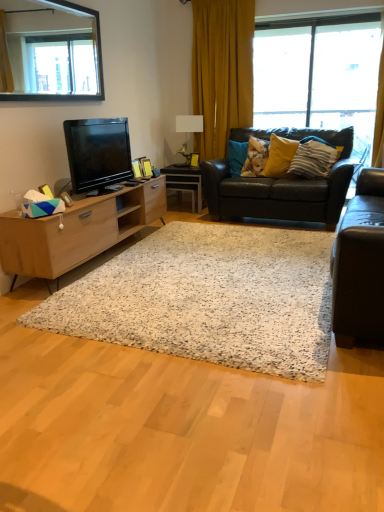
Where is `white glossy lamp at upper center`? This screenshot has width=384, height=512. white glossy lamp at upper center is located at coordinates (189, 123).

At what (x,y) coordinates should I click in order to perform the action: click on white shag rug at center. Please return your answer as a coordinate pair (x, y). The width and height of the screenshot is (384, 512). Looking at the image, I should click on (209, 298).

The height and width of the screenshot is (512, 384). Describe the element at coordinates (209, 298) in the screenshot. I see `white shag rug at center` at that location.

How much space does yellow matte pillow at upper right, acting as the second pillow starting from the left, occupy horizontally?

It is 27.36 centimeters.

How much space does yellow matte pillow at upper right, acting as the second pillow starting from the left, occupy vertically?

yellow matte pillow at upper right, acting as the second pillow starting from the left, is 18.69 inches tall.

The image size is (384, 512). What do you see at coordinates (318, 71) in the screenshot?
I see `transparent glass window at upper right` at bounding box center [318, 71].

This screenshot has width=384, height=512. In order to click on white glossy lamp at upper center in this screenshot , I will do `click(189, 123)`.

Is transparent glass window at upper right far from leather couch at right, the second studio couch positioned from the back?

transparent glass window at upper right is far away from leather couch at right, the second studio couch positioned from the back.

Considering the sizes of objects transparent glass window at upper right and leather couch at right, the second studio couch positioned from the back, in the image provided, who is taller, transparent glass window at upper right or leather couch at right, the second studio couch positioned from the back,?

Standing taller between the two is transparent glass window at upper right.

Between transparent glass window at upper right and leather couch at right, the second studio couch positioned from the back, which one has larger width?

Wider between the two is leather couch at right, the second studio couch positioned from the back.

How many degrees apart are the facing directions of black glass mirror at upper left and transparent glass window at upper right?

90.4 degrees separate the facing orientations of black glass mirror at upper left and transparent glass window at upper right.

From a real-world perspective, is black glass mirror at upper left on top of transparent glass window at upper right?

Yes, from a real-world perspective, black glass mirror at upper left is on top of transparent glass window at upper right.

Would you say black glass mirror at upper left is outside transparent glass window at upper right?

Indeed, black glass mirror at upper left is completely outside transparent glass window at upper right.

Is black glass mirror at upper left far away from transparent glass window at upper right?

black glass mirror at upper left is positioned a significant distance from transparent glass window at upper right.

Can you confirm if leather couch at center, arranged as the second studio couch when viewed from the front, is positioned to the right of fluffy fabric pillow at center, placed as the third pillow when sorted from right to left?

Yes.

Considering the relative sizes of leather couch at center, marked as the first studio couch in a back-to-front arrangement, and fluffy fabric pillow at center, which is counted as the first pillow, starting from the left, in the image provided, is leather couch at center, marked as the first studio couch in a back-to-front arrangement, bigger than fluffy fabric pillow at center, which is counted as the first pillow, starting from the left,?

Indeed, leather couch at center, marked as the first studio couch in a back-to-front arrangement, has a larger size compared to fluffy fabric pillow at center, which is counted as the first pillow, starting from the left.

Locate an element on the screen. The height and width of the screenshot is (512, 384). pillow that is on the left side of leather couch at center, marked as the first studio couch in a back-to-front arrangement is located at coordinates (255, 157).

From a real-world perspective, which object stands above the other?

In real-world perspective, fluffy fabric pillow at center, which is counted as the first pillow, starting from the left, is above.

The image size is (384, 512). What are the coordinates of `cabinetry that appears on the left of white shag rug at center` in the screenshot? It's located at (77, 230).

From the image's perspective, which object appears higher, light wood/finish tv stand at left or white shag rug at center?

light wood/finish tv stand at left is shown above in the image.

Which is less distant, (36, 226) or (56, 318)?

Clearly, point (36, 226) is more distant from the camera than point (56, 318).

Does light wood/finish tv stand at left contain white shag rug at center?

That's incorrect, white shag rug at center is not inside light wood/finish tv stand at left.

Is transparent glass window at upper right oriented towards yellow striped pillow at upper right, which is counted as the third pillow, starting from the left?

Yes.

Is transparent glass window at upper right not inside yellow striped pillow at upper right, which appears as the 1th pillow when viewed from the right?

Indeed, transparent glass window at upper right is completely outside yellow striped pillow at upper right, which appears as the 1th pillow when viewed from the right.

Is transparent glass window at upper right taller or shorter than yellow striped pillow at upper right, which is counted as the third pillow, starting from the left?

Considering their sizes, transparent glass window at upper right has more height than yellow striped pillow at upper right, which is counted as the third pillow, starting from the left.

From the image's perspective, is transparent glass window at upper right above or below yellow matte pillow at upper right, acting as the second pillow starting from the left?

Based on their image positions, transparent glass window at upper right is located above yellow matte pillow at upper right, acting as the second pillow starting from the left.

Which object is further away from the camera taking this photo, transparent glass window at upper right or yellow matte pillow at upper right, which is the second pillow in right-to-left order?

transparent glass window at upper right is behind.

In terms of size, does transparent glass window at upper right appear bigger or smaller than yellow matte pillow at upper right, which is the second pillow in right-to-left order?

Clearly, transparent glass window at upper right is larger in size than yellow matte pillow at upper right, which is the second pillow in right-to-left order.

Relative to light wood/finish tv stand at left, is transparent glass window at upper right in front or behind?

transparent glass window at upper right is positioned farther from the viewer than light wood/finish tv stand at left.

Is transparent glass window at upper right oriented towards light wood/finish tv stand at left?

Yes, transparent glass window at upper right faces towards light wood/finish tv stand at left.

From the image's perspective, is transparent glass window at upper right above or below light wood/finish tv stand at left?

transparent glass window at upper right is above light wood/finish tv stand at left.

The width and height of the screenshot is (384, 512). What are the coordinates of `cabinetry on the left of transparent glass window at upper right` in the screenshot? It's located at (77, 230).

At what (x,y) coordinates should I click in order to perform the action: click on studio couch that is the 1st one when counting leftward from the transparent glass window at upper right. Please return your answer as a coordinate pair (x, y). Looking at the image, I should click on (360, 264).

At what (x,y) coordinates should I click in order to perform the action: click on window that is above the black glass mirror at upper left (from the image's perspective). Please return your answer as a coordinate pair (x, y). Looking at the image, I should click on (318, 71).

When comparing their distances from leather couch at center, arranged as the second studio couch when viewed from the front, does white shag rug at center or transparent glass window at upper right seem further?

white shag rug at center.

Based on the photo, from the image, which object appears to be nearer to black glossy television at left, white shag rug at center or white glossy desk at center?

white shag rug at center is positioned closer to the anchor black glossy television at left.

From the image, which object appears to be nearer to white glossy desk at center, black glossy television at left or leather couch at right, the second studio couch positioned from the back?

black glossy television at left is positioned closer to the anchor white glossy desk at center.

From the picture: Based on their spatial positions, is leather couch at center, arranged as the second studio couch when viewed from the front, or white shag rug at center further from white glossy desk at center?

The object further to white glossy desk at center is white shag rug at center.

When comparing their distances from black glass mirror at upper left, does black glossy television at left or white glossy desk at center seem closer?

Based on the image, black glossy television at left appears to be nearer to black glass mirror at upper left.

When comparing their distances from leather couch at center, marked as the first studio couch in a back-to-front arrangement, does leather couch at right, the second studio couch positioned from the back, or white shag rug at center seem closer?

Among the two, white shag rug at center is located nearer to leather couch at center, marked as the first studio couch in a back-to-front arrangement.

Based on the photo, when comparing their distances from fluffy fabric pillow at center, placed as the third pillow when sorted from right to left, does black glossy television at left or yellow matte pillow at upper right, which is the second pillow in right-to-left order, seem closer?

Based on the image, yellow matte pillow at upper right, which is the second pillow in right-to-left order, appears to be nearer to fluffy fabric pillow at center, placed as the third pillow when sorted from right to left.

Considering their positions, is white glossy lamp at upper center positioned further to white shag rug at center than light wood/finish tv stand at left?

Among the two, white glossy lamp at upper center is located further to white shag rug at center.

This screenshot has height=512, width=384. What are the coordinates of `curtain located between light wood/finish tv stand at left and white glossy lamp at upper center in the depth direction` in the screenshot? It's located at (222, 71).

The image size is (384, 512). In order to click on curtain between white shag rug at center and white glossy lamp at upper center in the front-back direction in this screenshot , I will do `click(222, 71)`.

The image size is (384, 512). I want to click on plain located between leather couch at right, acting as the first studio couch starting from the front, and yellow fabric curtain at upper center in the depth direction, so click(x=209, y=298).

The width and height of the screenshot is (384, 512). Identify the location of curtain positioned between leather couch at center, marked as the first studio couch in a back-to-front arrangement, and white glossy lamp at upper center from near to far. pos(222,71).